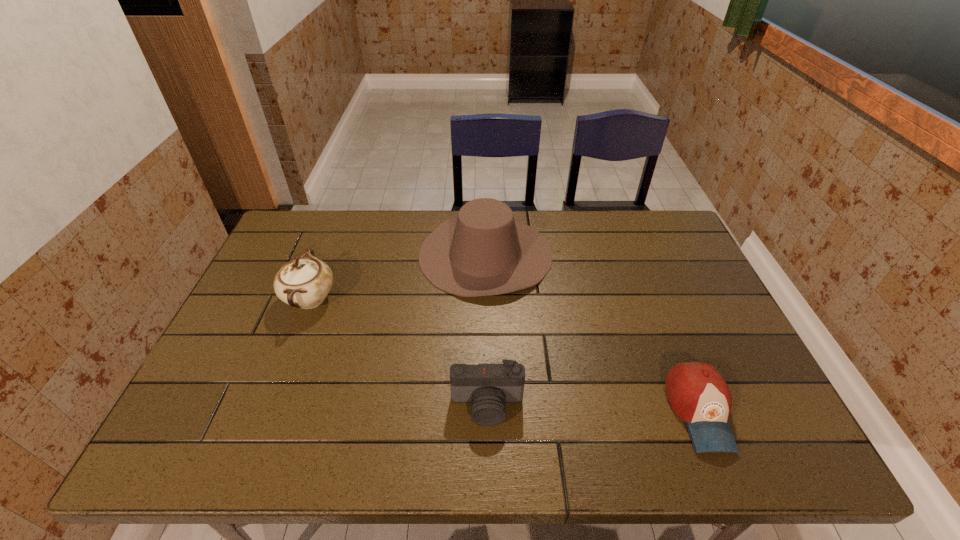
The image size is (960, 540). I want to click on baseball cap that is at the near edge, so click(x=698, y=394).

You are a GUI agent. You are given a task and a screenshot of the screen. Output one action in this format:
    pyautogui.click(x=<x>, y=<y>)
    Task: Click on the object present at the left edge
    This screenshot has width=960, height=540.
    Given the screenshot: What is the action you would take?
    pyautogui.click(x=303, y=282)

Locate an element on the screen. The height and width of the screenshot is (540, 960). object that is at the right edge is located at coordinates (698, 394).

Locate an element on the screen. The image size is (960, 540). object at the near right corner is located at coordinates (698, 394).

In the image, there is a desktop. At what (x,y) coordinates should I click in order to perform the action: click on vacant space at the far edge. Please return your answer as a coordinate pair (x, y). Looking at the image, I should click on (398, 223).

The width and height of the screenshot is (960, 540). Find the location of `vacant space at the near edge of the desktop`. vacant space at the near edge of the desktop is located at coordinates pos(456,459).

At what (x,y) coordinates should I click in order to perform the action: click on vacant area at the left edge. Please return your answer as a coordinate pair (x, y). Looking at the image, I should click on (258, 396).

Locate an element on the screen. vacant space at the right edge of the desktop is located at coordinates (678, 264).

In the image, there is a desktop. At what (x,y) coordinates should I click in order to perform the action: click on vacant space at the far left corner. Please return your answer as a coordinate pair (x, y). Looking at the image, I should click on (335, 218).

Find the location of `free region at the far right corner of the desktop`. free region at the far right corner of the desktop is located at coordinates (626, 213).